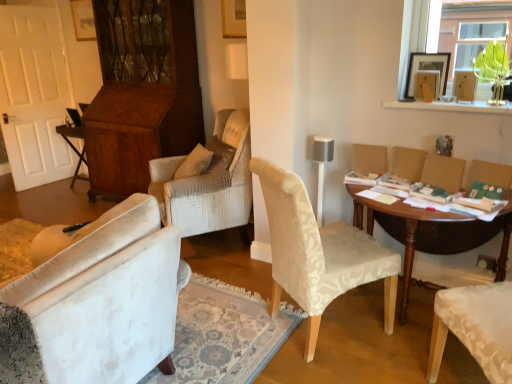
Question: Is transparent glass vase at upper right turned away from light beige fabric chair at center?

Choices:
 (A) yes
 (B) no

Answer: (B)

Question: From the image's perspective, is transparent glass vase at upper right beneath light beige fabric chair at center?

Choices:
 (A) no
 (B) yes

Answer: (A)

Question: From a real-world perspective, is transparent glass vase at upper right on top of light beige fabric chair at center?

Choices:
 (A) yes
 (B) no

Answer: (A)

Question: Would you say transparent glass vase at upper right contains light beige fabric chair at center?

Choices:
 (A) yes
 (B) no

Answer: (B)

Question: From the image's perspective, is transparent glass vase at upper right on top of light beige fabric chair at center?

Choices:
 (A) no
 (B) yes

Answer: (B)

Question: Can you confirm if transparent glass vase at upper right is shorter than light beige fabric chair at center?

Choices:
 (A) no
 (B) yes

Answer: (B)

Question: Is matte beige armchair at right, placed as the 1th armchair when sorted from left to right, outside of wooden folding table at left, which appears as the 1th table when viewed from the back?

Choices:
 (A) no
 (B) yes

Answer: (B)

Question: Considering the relative sizes of matte beige armchair at right, marked as the 3th armchair in a right-to-left arrangement, and wooden folding table at left, which is the 1th table from top to bottom, in the image provided, is matte beige armchair at right, marked as the 3th armchair in a right-to-left arrangement, taller than wooden folding table at left, which is the 1th table from top to bottom,?

Choices:
 (A) no
 (B) yes

Answer: (A)

Question: From a real-world perspective, is matte beige armchair at right, placed as the 1th armchair when sorted from left to right, positioned over wooden folding table at left, the second table when ordered from bottom to top, based on gravity?

Choices:
 (A) yes
 (B) no

Answer: (A)

Question: Are matte beige armchair at right, placed as the 1th armchair when sorted from left to right, and wooden folding table at left, the 1th table positioned from the left, located far from each other?

Choices:
 (A) yes
 (B) no

Answer: (A)

Question: Is matte beige armchair at right, marked as the 3th armchair in a right-to-left arrangement, directly adjacent to wooden folding table at left, which appears as the 1th table when viewed from the back?

Choices:
 (A) yes
 (B) no

Answer: (B)

Question: From the image's perspective, is matte beige armchair at right, placed as the 1th armchair when sorted from left to right, on top of wooden folding table at left, positioned as the second table in front-to-back order?

Choices:
 (A) no
 (B) yes

Answer: (A)

Question: Is transparent glass vase at upper right at the right side of matte beige armchair at right, which is the 2th armchair in left-to-right order?

Choices:
 (A) yes
 (B) no

Answer: (A)